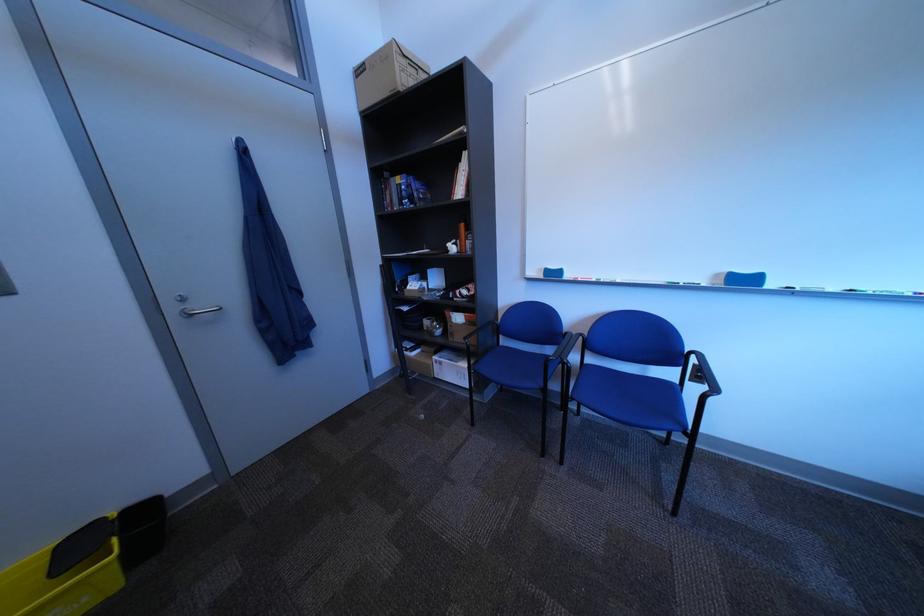
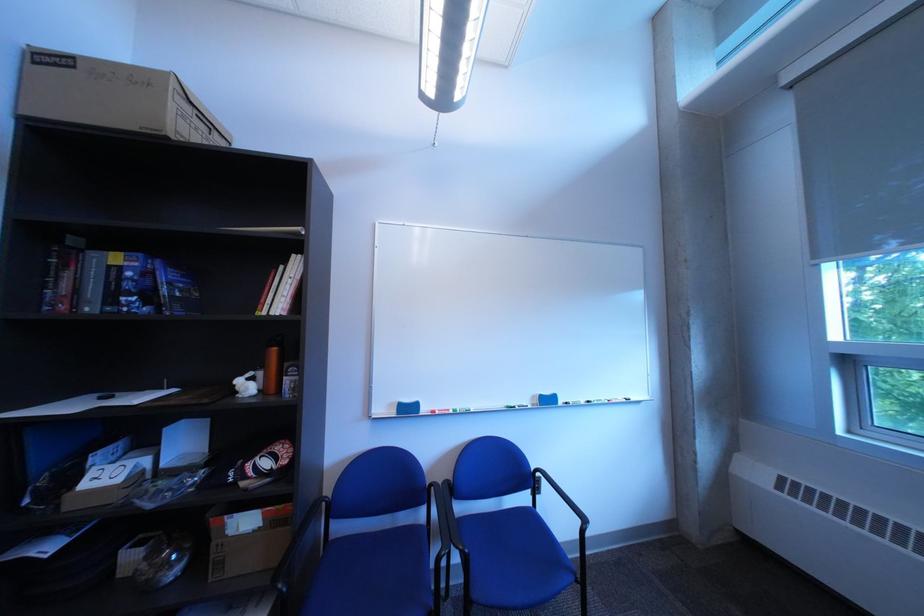
In the second image, find the point that corresponds to pixel 585 366 in the first image.

(482, 553)